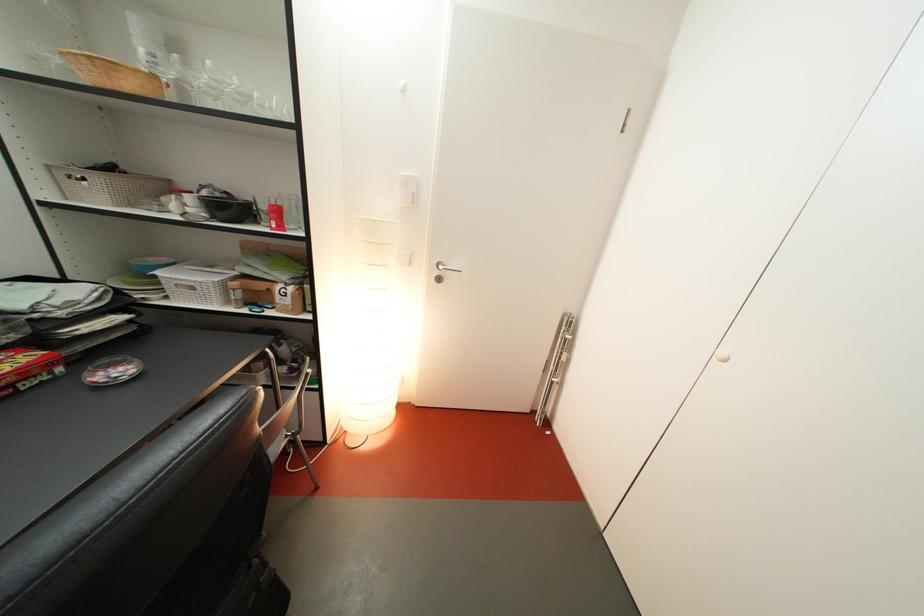
Find where to lift the metal folding rack. Please return your answer as a coordinate pair (x, y).

(554, 365)